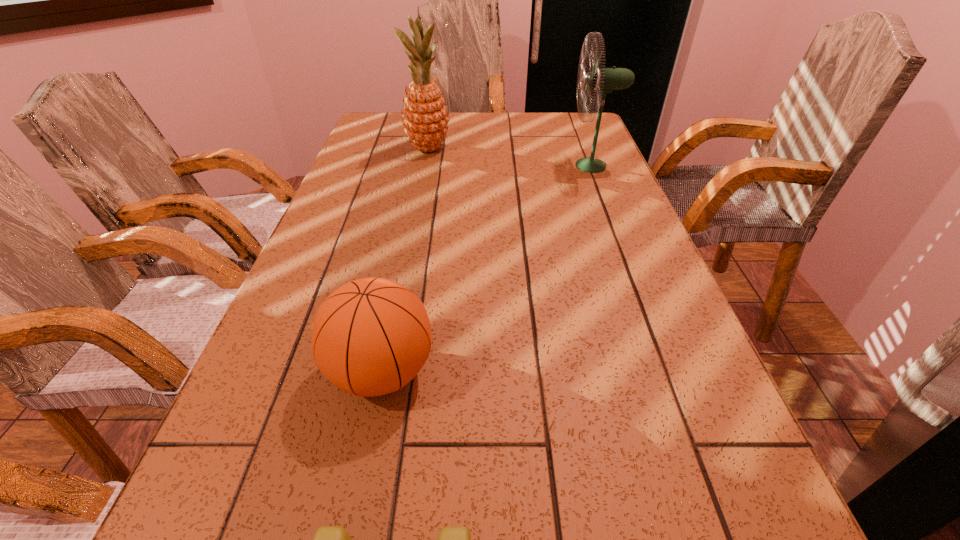
Where is `pineapple`? The image size is (960, 540). pineapple is located at coordinates (425, 118).

Where is `the rightmost object`? the rightmost object is located at coordinates [602, 80].

What are the coordinates of `basketball` in the screenshot? It's located at (370, 337).

At what (x,y) coordinates should I click in order to perform the action: click on the second nearest object. Please return your answer as a coordinate pair (x, y). Looking at the image, I should click on (370, 337).

This screenshot has height=540, width=960. What are the coordinates of `free region located 0.070m on the front of the pineapple` in the screenshot? It's located at (423, 171).

This screenshot has width=960, height=540. What are the coordinates of `vacant space located on the front-facing side of the fan` in the screenshot? It's located at (459, 166).

Locate an element on the screen. This screenshot has height=540, width=960. free space located 0.200m on the front-facing side of the fan is located at coordinates pyautogui.click(x=503, y=166).

At what (x,y) coordinates should I click in order to perform the action: click on vacant region located on the front-facing side of the fan. Please return your answer as a coordinate pair (x, y). This screenshot has width=960, height=540. Looking at the image, I should click on (436, 166).

I want to click on free space located 0.110m on the left of the second shortest object, so click(265, 372).

The image size is (960, 540). Find the location of `object that is at the far edge`. object that is at the far edge is located at coordinates (425, 118).